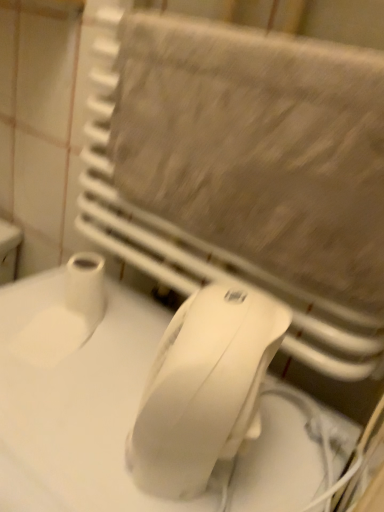
This screenshot has width=384, height=512. Identify the location of vacant space to the left of white plastic mouse at center. point(57,407).